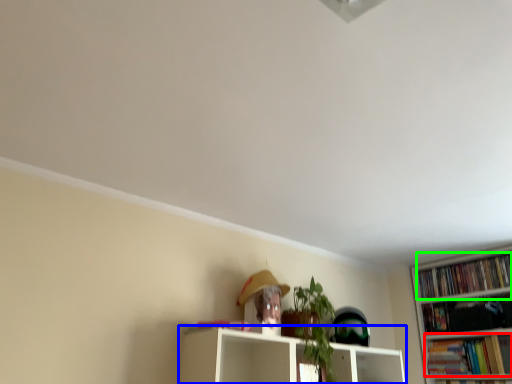
Question: Estimate the real-world distances between objects in this image. Which object is farther from book (highlighted by a red box), shelf (highlighted by a blue box) or book (highlighted by a green box)?

Choices:
 (A) shelf
 (B) book

Answer: (A)